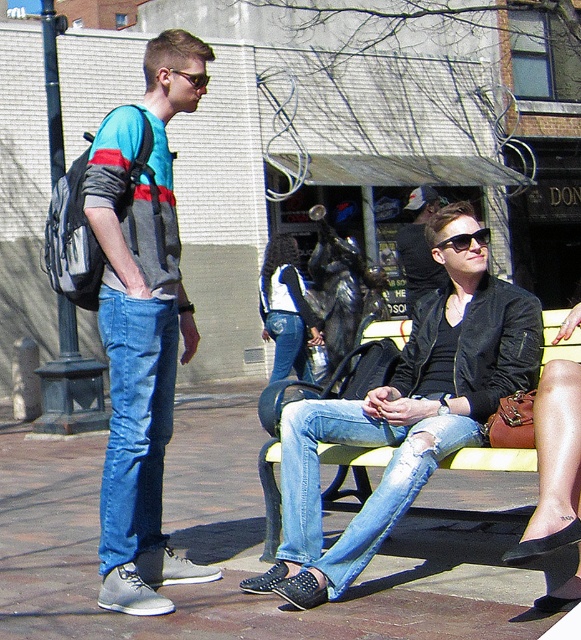
You are a fashion designer observing the jackets in the image. Which jacket, the denim jacket at center or the leather jacket at center, is positioned lower on the person?

The denim jacket at center is located below the leather jacket at center, so the denim jacket at center is positioned lower.

You are a photographer trying to capture both the matte blue jeans at left and the leather jacket at center in a single shot. Based on their heights, which object should you adjust your camera angle to focus on first to ensure both are in frame?

The matte blue jeans at left is much taller than the leather jacket at center, so you should focus on the matte blue jeans at left first to ensure the entire height of both objects fits within the frame.

You are a fashion designer observing the denim jacket at center and the leather jacket at center in the image. Which jacket would you recommend to a client who wants a more voluminous silhouette?

The denim jacket at center has a greater height compared to the leather jacket at center, making it a better choice for a voluminous silhouette.